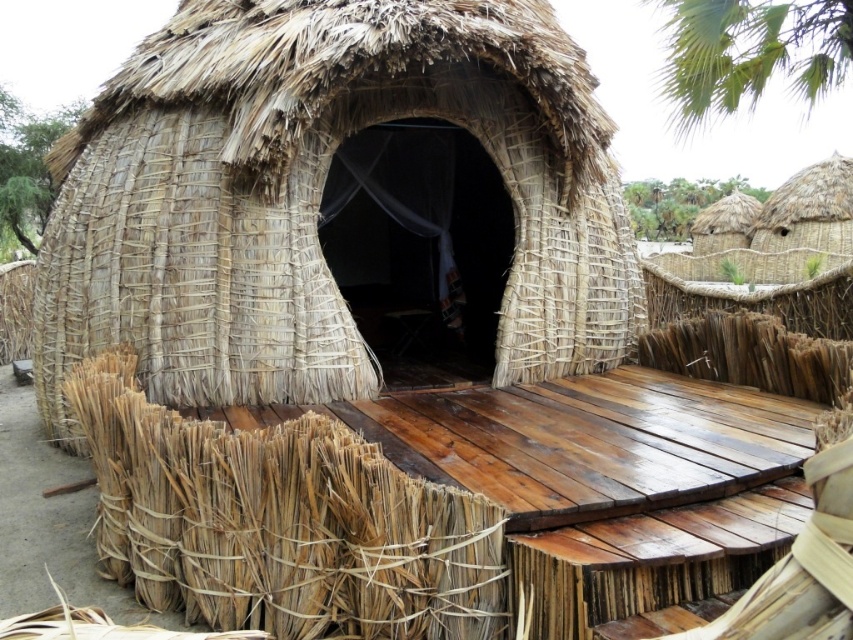
Can you confirm if natural straw hut at center is taller than brown woven reed at center?

Yes.

Is natural straw hut at center above brown woven reed at center?

Correct, natural straw hut at center is located above brown woven reed at center.

You are a GUI agent. You are given a task and a screenshot of the screen. Output one action in this format:
    pyautogui.click(x=<x>, y=<y>)
    Task: Click on the natural straw hut at center
    The height and width of the screenshot is (640, 853).
    Given the screenshot: What is the action you would take?
    pyautogui.click(x=316, y=196)

Does brown woven reed at center lie in front of green leafy palm tree at upper right?

Yes.

Does brown woven reed at center appear on the right side of green leafy palm tree at upper right?

No, brown woven reed at center is not to the right of green leafy palm tree at upper right.

Does point (378, 616) come farther from viewer compared to point (730, 42)?

No, it is not.

In order to click on brown woven reed at center in this screenshot , I will do `click(281, 522)`.

Is brown woven reed at center to the right of natural straw hut at upper right from the viewer's perspective?

In fact, brown woven reed at center is to the left of natural straw hut at upper right.

Does brown woven reed at center appear over natural straw hut at upper right?

No, brown woven reed at center is not above natural straw hut at upper right.

Does point (233, 579) come farther from viewer compared to point (793, 301)?

No, it is not.

You are a GUI agent. You are given a task and a screenshot of the screen. Output one action in this format:
    pyautogui.click(x=<x>, y=<y>)
    Task: Click on the brown woven reed at center
    
    Given the screenshot: What is the action you would take?
    pyautogui.click(x=281, y=522)